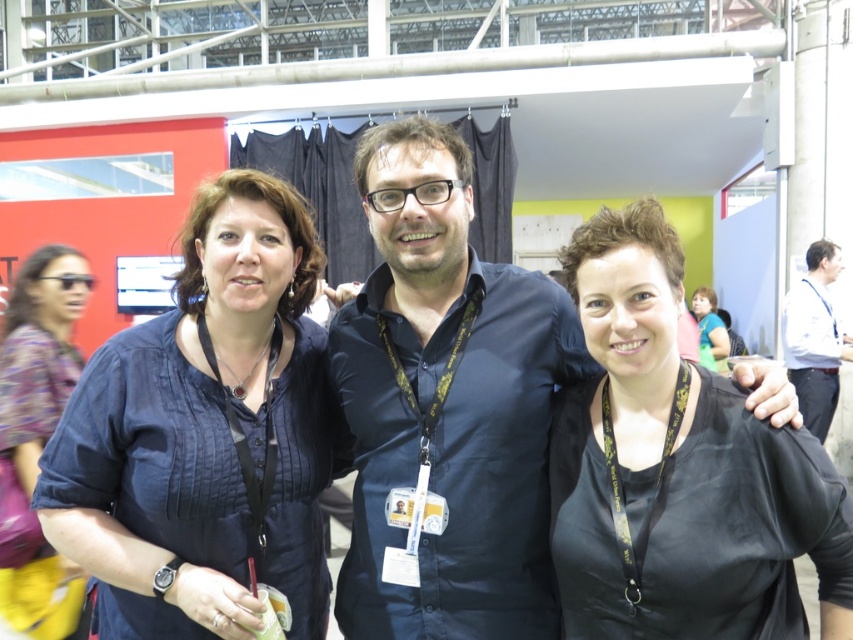
Between printed fabric blouse at left and matte black shirt at upper right, which one appears on the right side from the viewer's perspective?

matte black shirt at upper right is more to the right.

Is printed fabric blouse at left bigger than matte black shirt at upper right?

Actually, printed fabric blouse at left might be smaller than matte black shirt at upper right.

Does point (64, 332) come closer to viewer compared to point (709, 310)?

Yes, it is in front of point (709, 310).

Image resolution: width=853 pixels, height=640 pixels. I want to click on printed fabric blouse at left, so click(x=36, y=436).

Does point (746, 426) come farther from viewer compared to point (28, 513)?

No, it is in front of (28, 513).

Between black silk blouse at center and printed fabric blouse at left, which one is positioned lower?

printed fabric blouse at left is lower down.

Which is in front, point (656, 486) or point (6, 413)?

Point (656, 486)

In order to click on black silk blouse at center in this screenshot , I will do `click(677, 468)`.

Who is taller, matte blue blouse at center or white shirt at right?

white shirt at right is taller.

Describe the element at coordinates (206, 433) in the screenshot. The width and height of the screenshot is (853, 640). I see `matte blue blouse at center` at that location.

Which is in front, point (207, 324) or point (801, 336)?

Point (207, 324) is in front.

Find the location of a particular element. matte blue blouse at center is located at coordinates (206, 433).